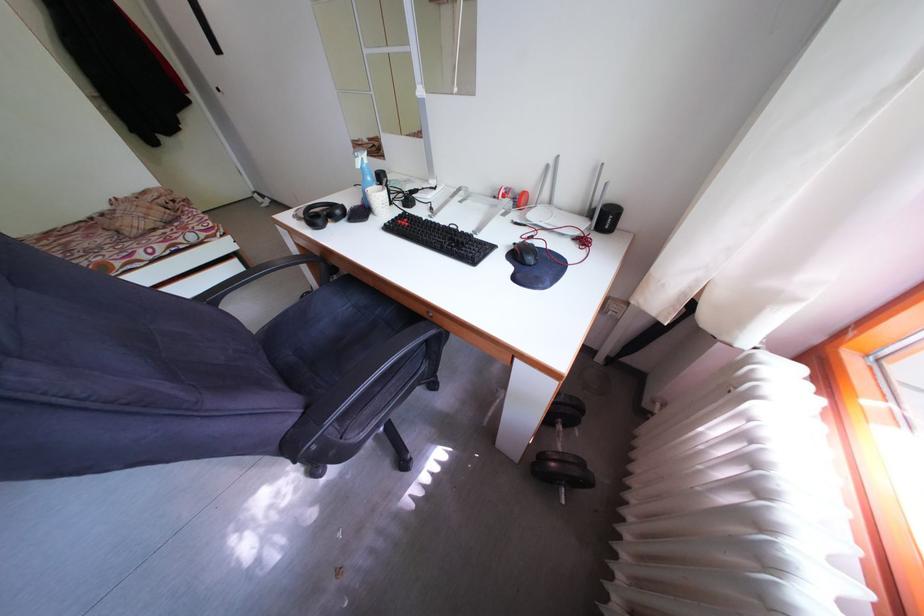
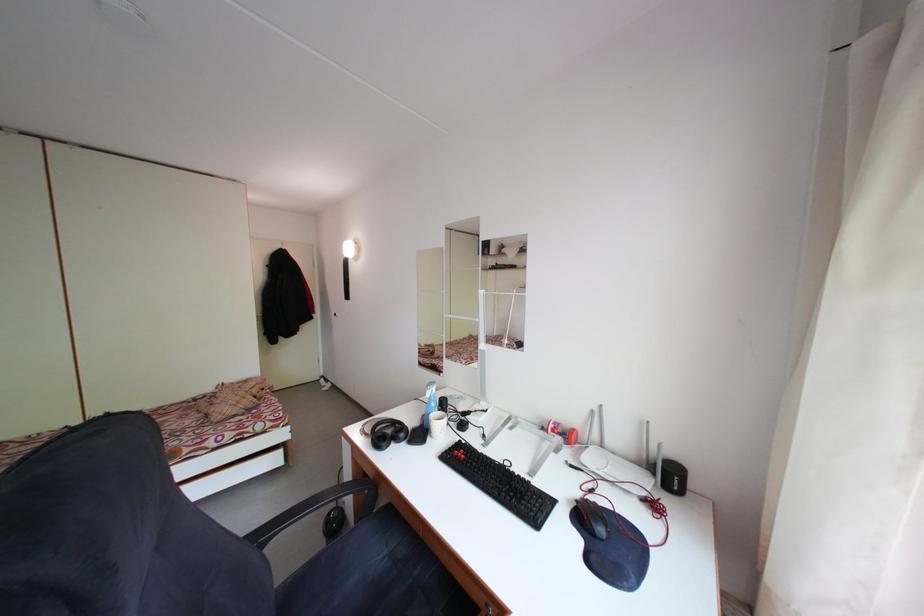
Question: Based on the continuous images, in which direction is the camera rotating? Reply with the corresponding letter.

Choices:
 (A) Left
 (B) Right
 (C) Up
 (D) Down

Answer: (C)